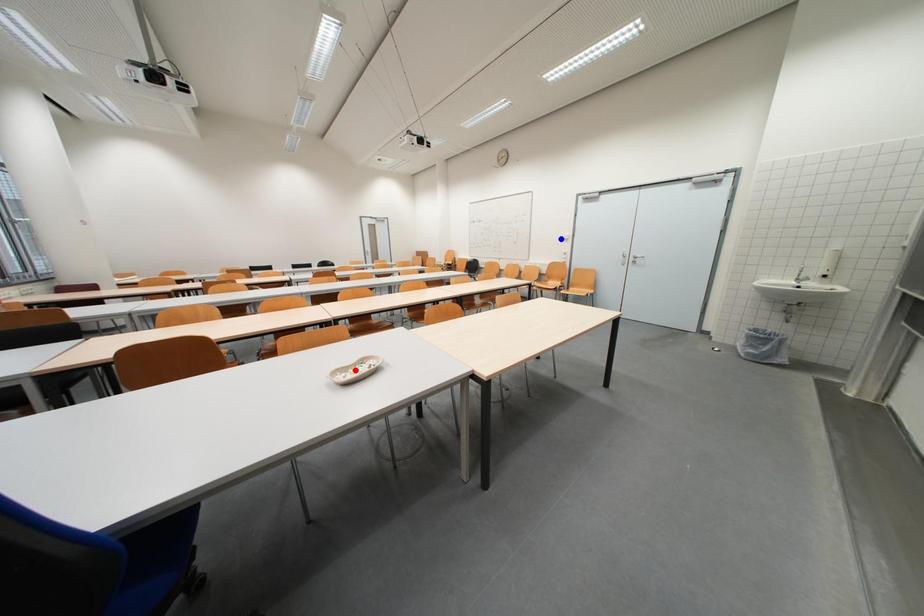
Question: Two points are marked on the image. Which point is closer to the camera?

Choices:
 (A) Blue point is closer.
 (B) Red point is closer.

Answer: (B)